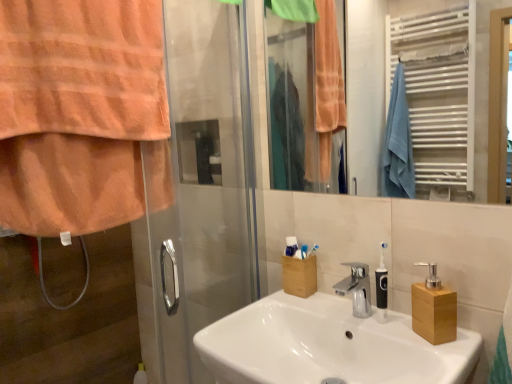
Question: Are white matte toothbrush holder at center and wooden block at right, placed as the first soap dispenser when sorted from left to right, making contact?

Choices:
 (A) no
 (B) yes

Answer: (A)

Question: Is the position of white matte toothbrush holder at center less distant than that of wooden block at right, placed as the first soap dispenser when sorted from left to right?

Choices:
 (A) no
 (B) yes

Answer: (A)

Question: From a real-world perspective, is white matte toothbrush holder at center positioned over wooden block at right, placed as the first soap dispenser when sorted from left to right, based on gravity?

Choices:
 (A) yes
 (B) no

Answer: (A)

Question: Is white matte toothbrush holder at center smaller than wooden block at right, placed as the 2th soap dispenser when sorted from right to left?

Choices:
 (A) no
 (B) yes

Answer: (B)

Question: Is white matte toothbrush holder at center bigger than wooden block at right, placed as the 2th soap dispenser when sorted from right to left?

Choices:
 (A) no
 (B) yes

Answer: (A)

Question: Does white matte toothbrush holder at center have a greater width compared to wooden block at right, placed as the first soap dispenser when sorted from left to right?

Choices:
 (A) yes
 (B) no

Answer: (B)

Question: Does wooden block at right, placed as the 2th soap dispenser when sorted from right to left, have a lesser width compared to white matte toothbrush holder at center?

Choices:
 (A) no
 (B) yes

Answer: (A)

Question: Is wooden block at right, placed as the 2th soap dispenser when sorted from right to left, positioned before white matte toothbrush holder at center?

Choices:
 (A) yes
 (B) no

Answer: (A)

Question: Is wooden block at right, placed as the 2th soap dispenser when sorted from right to left, positioned beyond the bounds of white matte toothbrush holder at center?

Choices:
 (A) yes
 (B) no

Answer: (A)

Question: Is wooden block at right, placed as the first soap dispenser when sorted from left to right, behind white matte toothbrush holder at center?

Choices:
 (A) yes
 (B) no

Answer: (B)

Question: Does wooden block at right, placed as the first soap dispenser when sorted from left to right, appear on the left side of white matte toothbrush holder at center?

Choices:
 (A) no
 (B) yes

Answer: (A)

Question: From the image's perspective, is wooden block at right, placed as the 2th soap dispenser when sorted from right to left, over white matte toothbrush holder at center?

Choices:
 (A) yes
 (B) no

Answer: (B)

Question: Is wooden block soap dispenser at right, the second soap dispenser from the left, at the left side of metallic silver towel rack at upper right?

Choices:
 (A) no
 (B) yes

Answer: (A)